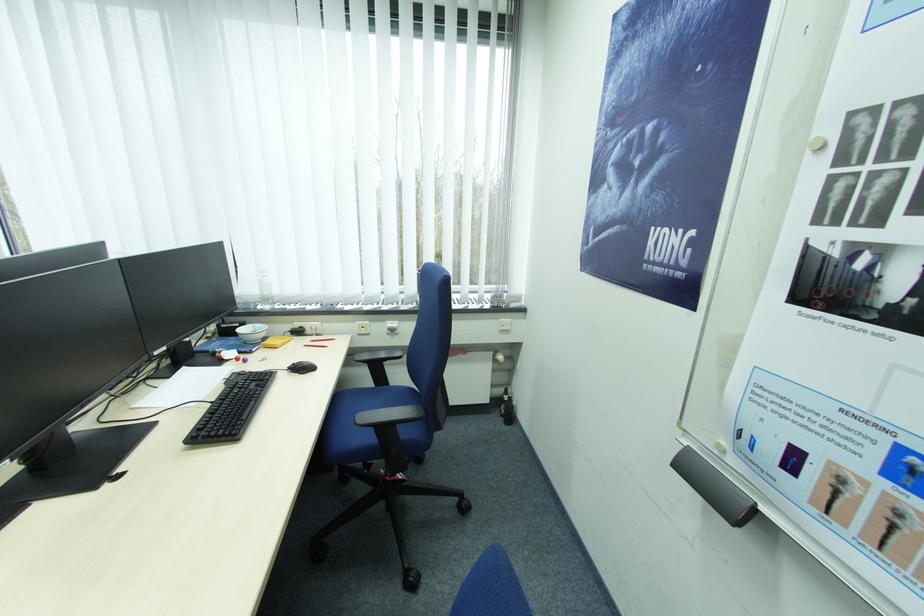
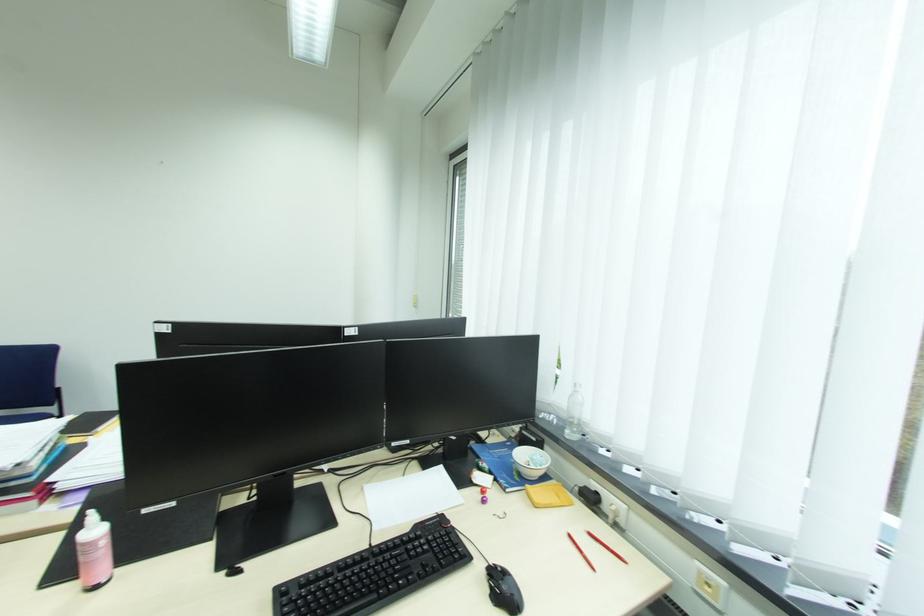
Question: How did the camera likely rotate?

Choices:
 (A) Left
 (B) Right
 (C) Up
 (D) Down

Answer: (A)